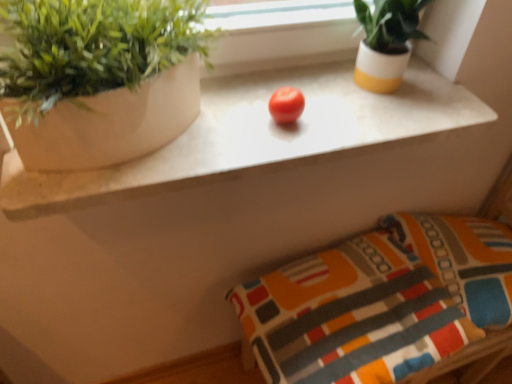
At what (x,y) coordinates should I click in order to perform the action: click on vacant area that lies between matte white pot at upper left and red matte tomato at center. Please return your answer as a coordinate pair (x, y). Looking at the image, I should click on (243, 123).